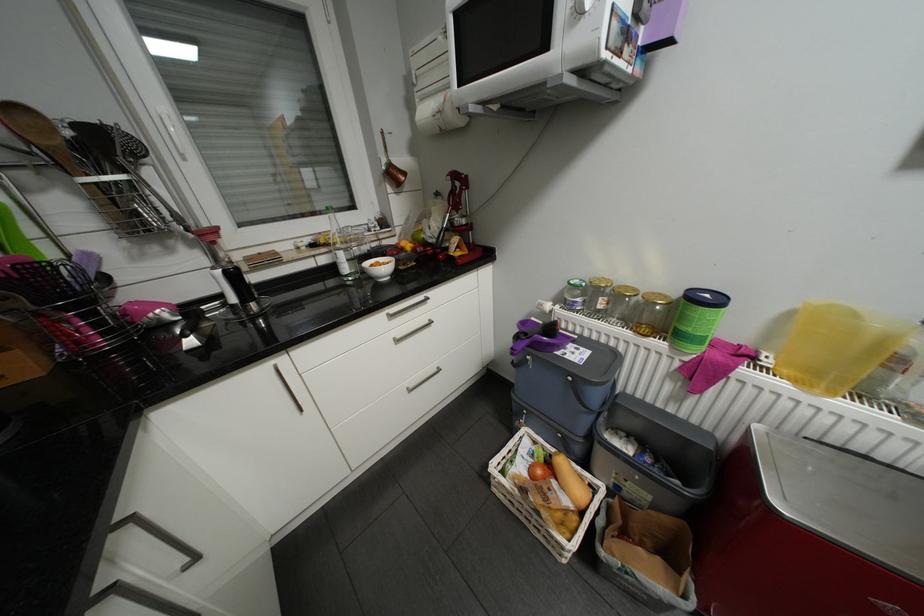
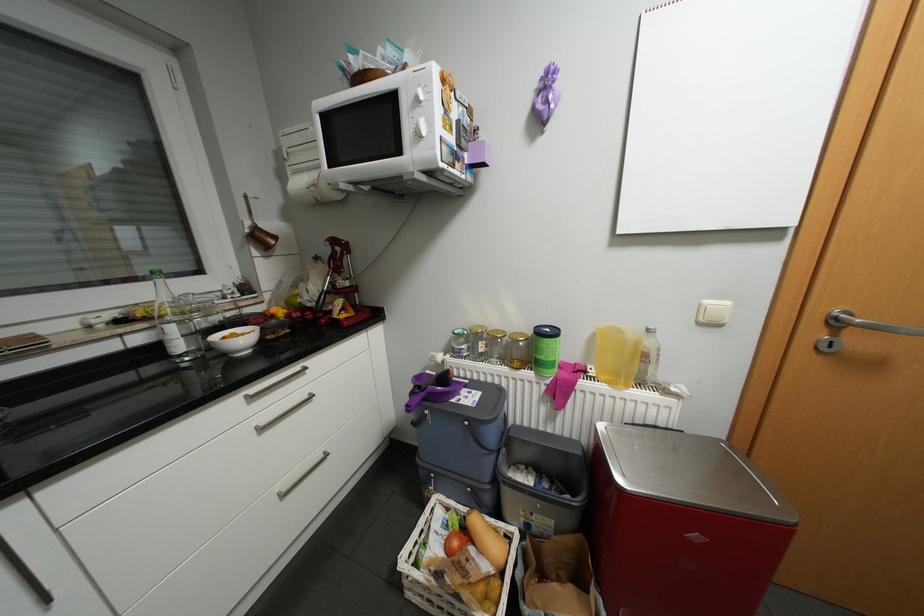
The point at [565,306] is marked in the first image. Where is the corresponding point in the second image?

(456, 355)